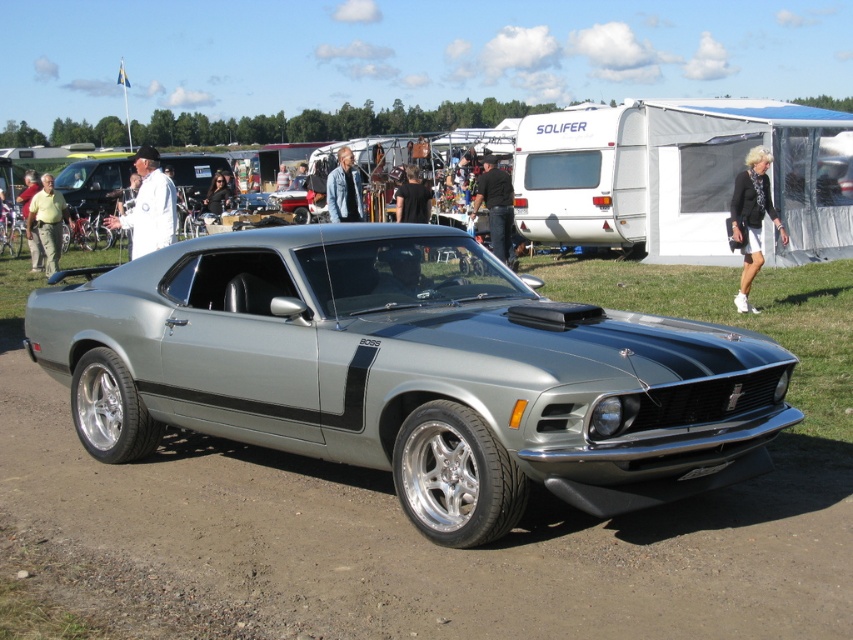
Does denim jacket at center appear on the right side of dark hair at center?

Yes, denim jacket at center is to the right of dark hair at center.

Measure the distance between denim jacket at center and camera.

denim jacket at center is 14.76 meters away from camera.

At what (x,y) coordinates should I click in order to perform the action: click on denim jacket at center. Please return your answer as a coordinate pair (x, y). This screenshot has width=853, height=640. Looking at the image, I should click on (344, 189).

Does black cotton shirt at center lie in front of light brown leather jacket at left?

Yes, it is in front of light brown leather jacket at left.

Can you confirm if black cotton shirt at center is positioned to the right of light brown leather jacket at left?

Yes, black cotton shirt at center is to the right of light brown leather jacket at left.

This screenshot has width=853, height=640. In order to click on black cotton shirt at center in this screenshot , I will do `click(496, 208)`.

Does satin silver muscle car at center have a lesser height compared to white cloth at center?

Yes, satin silver muscle car at center is shorter than white cloth at center.

Consider the image. Between satin silver muscle car at center and white cloth at center, which one has less height?

satin silver muscle car at center is shorter.

Consider the image. Measure the distance between satin silver muscle car at center and camera.

A distance of 13.34 feet exists between satin silver muscle car at center and camera.

At what (x,y) coordinates should I click in order to perform the action: click on satin silver muscle car at center. Please return your answer as a coordinate pair (x, y). This screenshot has width=853, height=640. Looking at the image, I should click on (409, 372).